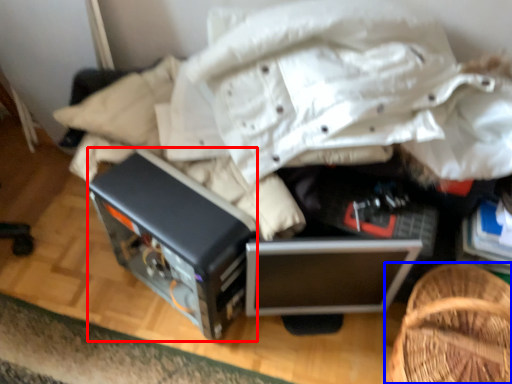
Question: Which point is closer to the camera, appliance (highlighted by a red box) or furniture (highlighted by a blue box)?

Choices:
 (A) appliance
 (B) furniture

Answer: (B)